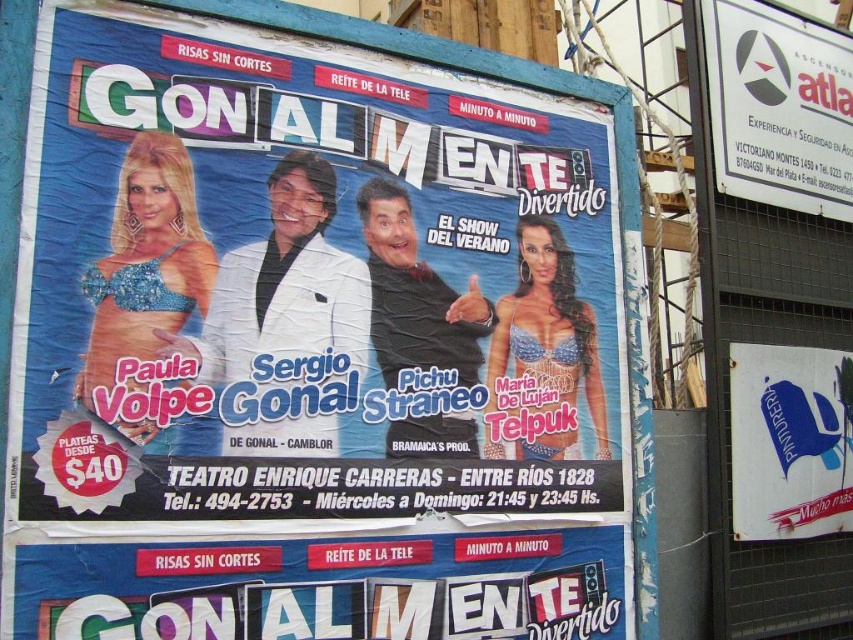
Consider the image. What is the spatial relationship between the blue cardboard sign at center and the white plastic sign at upper right in the billboard advertisement?

The blue cardboard sign at center is located below the white plastic sign at upper right.

Consider the image. What is the relationship in size between the blue paper poster at upper left and the blue cardboard sign at center?

The blue paper poster at upper left is bigger than the blue cardboard sign at center.